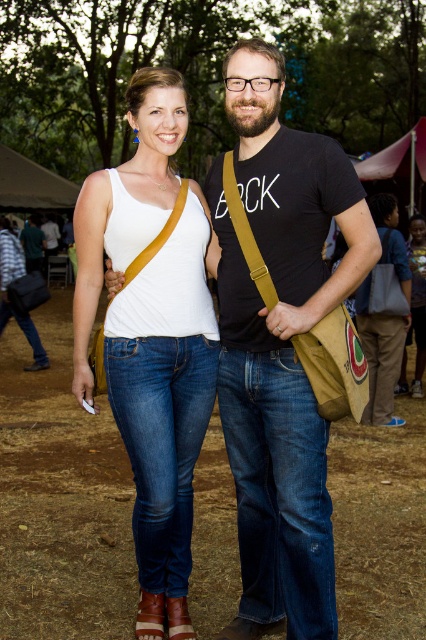
Question: Which of the following is the closest to the observer?

Choices:
 (A) (86, 380)
 (B) (253, 529)

Answer: (B)

Question: Which point is farther to the camera?

Choices:
 (A) (307, 472)
 (B) (138, 202)

Answer: (B)

Question: Is black cotton t-shirt at center closer to camera compared to white matte tank top at center?

Choices:
 (A) yes
 (B) no

Answer: (A)

Question: Considering the relative positions of black cotton t-shirt at center and white matte tank top at center in the image provided, where is black cotton t-shirt at center located with respect to white matte tank top at center?

Choices:
 (A) left
 (B) right

Answer: (B)

Question: Does black cotton t-shirt at center have a greater width compared to white matte tank top at center?

Choices:
 (A) yes
 (B) no

Answer: (A)

Question: Which of the following is the farthest from the observer?

Choices:
 (A) (250, 65)
 (B) (172, 193)

Answer: (B)